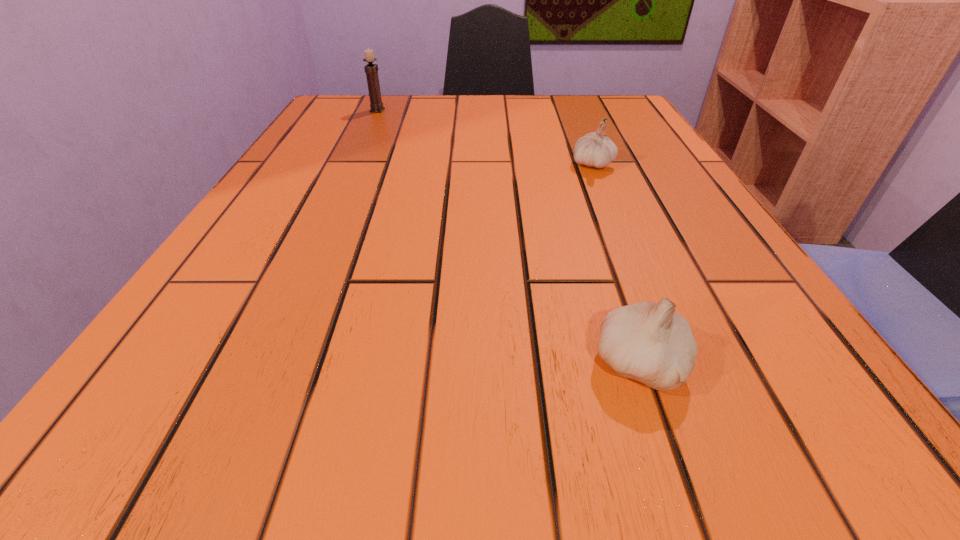
Locate an element on the screen. The width and height of the screenshot is (960, 540). the farthest object is located at coordinates (371, 70).

The image size is (960, 540). I want to click on the leftmost object, so click(371, 70).

Identify the location of the second farthest object. (595, 149).

The width and height of the screenshot is (960, 540). Find the location of `the nearer garlic`. the nearer garlic is located at coordinates (651, 343).

Find the location of a particular element. The width and height of the screenshot is (960, 540). vacant space situated 0.370m on the front of the leftmost object is located at coordinates (339, 193).

This screenshot has width=960, height=540. I want to click on free location located 0.280m on the left of the farther garlic, so click(425, 164).

Image resolution: width=960 pixels, height=540 pixels. Find the location of `vacant space located on the left of the nearest object`. vacant space located on the left of the nearest object is located at coordinates (340, 364).

Locate an element on the screen. The image size is (960, 540). object at the far edge is located at coordinates (371, 70).

Find the location of a particular element. This screenshot has height=540, width=960. object at the near edge is located at coordinates (651, 343).

Locate an element on the screen. Image resolution: width=960 pixels, height=540 pixels. object present at the left edge is located at coordinates (371, 70).